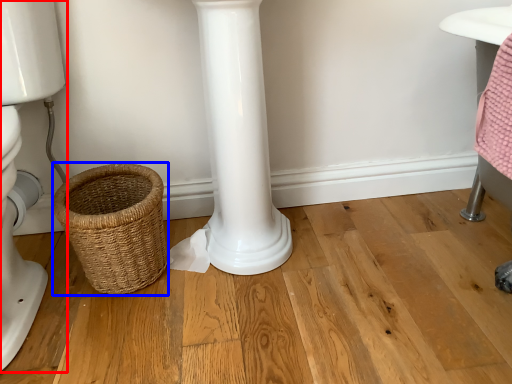
Question: Which object appears closest to the camera in this image, toilet (highlighted by a red box) or basket (highlighted by a blue box)?

Choices:
 (A) toilet
 (B) basket

Answer: (A)